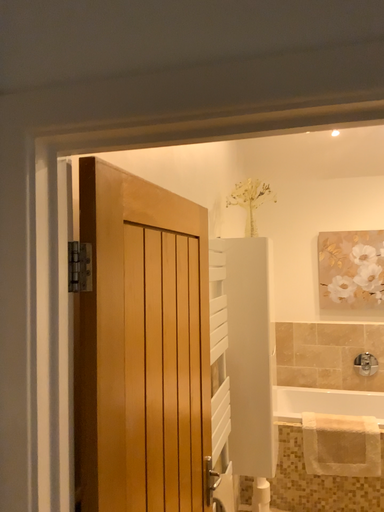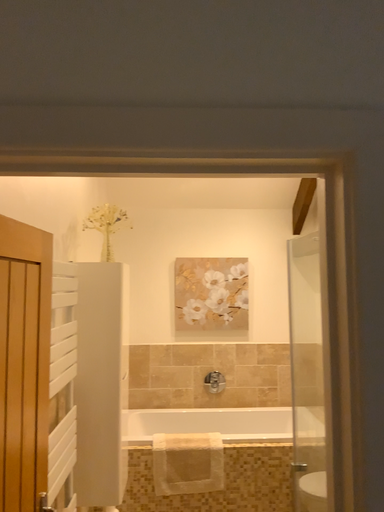
Question: How did the camera likely rotate when shooting the video?

Choices:
 (A) rotated right
 (B) rotated left

Answer: (A)